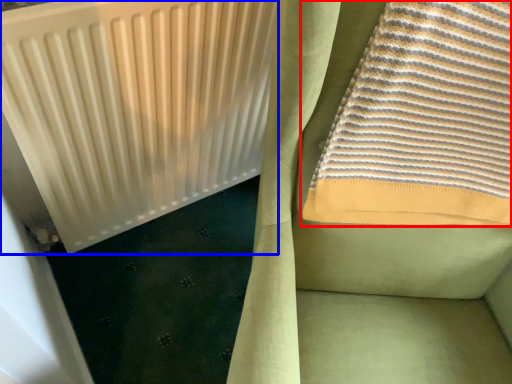
Question: Which point is further to the camera, towel (highlighted by a red box) or radiator (highlighted by a blue box)?

Choices:
 (A) towel
 (B) radiator

Answer: (B)